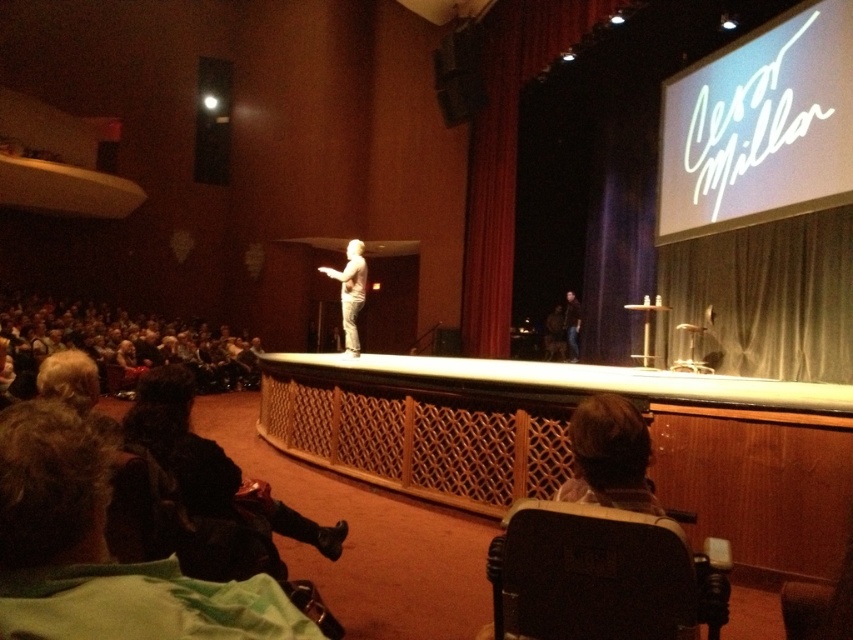
Question: From the image, what is the correct spatial relationship of matte black speaker at upper center in relation to dark gray jeans at center?

Choices:
 (A) right
 (B) left

Answer: (B)

Question: Which point is farther to the camera?

Choices:
 (A) dark gray jeans at center
 (B) smooth white statue at center

Answer: (A)

Question: Estimate the real-world distances between objects in this image. Which object is closer to the smooth white statue at center?

Choices:
 (A) matte black speaker at upper center
 (B) matte black speaker at upper left

Answer: (A)

Question: Does matte black speaker at upper left have a larger size compared to smooth white statue at center?

Choices:
 (A) no
 (B) yes

Answer: (B)

Question: Which of the following is the farthest from the observer?

Choices:
 (A) dark gray jeans at center
 (B) matte black speaker at upper center
 (C) matte black speaker at upper left

Answer: (C)

Question: Can you confirm if black plastic wheelchair at lower right is positioned to the left of matte black speaker at upper center?

Choices:
 (A) no
 (B) yes

Answer: (B)